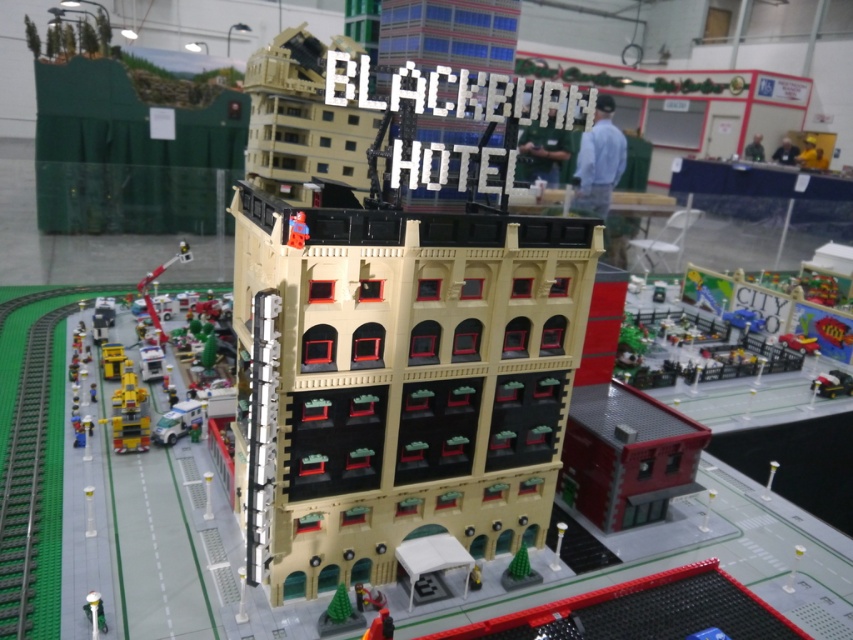
You are standing in front of the beige plastic building at center and want to walk to the yellow plastic toy car at lower left. Which direction should you move to get closer to the car?

Since the beige plastic building at center is closer to the viewer than the yellow plastic toy car at lower left, you should move forward to get closer to the car.

You are a Lego figure standing next to the yellow plastic toy car at lower left. You want to reach the top of the beige plastic building at center. Is the building so tall that you can see it from your current position?

The beige plastic building at center is much taller than the yellow plastic toy car at lower left, so yes, the Lego figure can see the top of the beige plastic building at center from their current position.